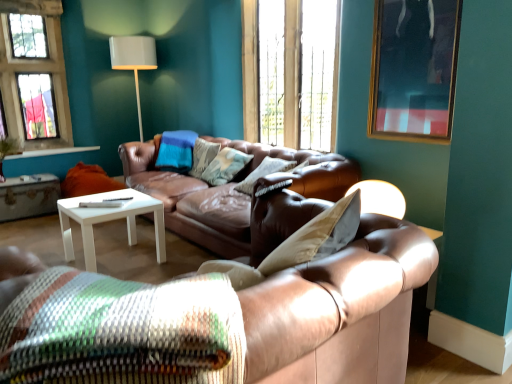
Describe the element at coordinates (225, 166) in the screenshot. I see `textured beige pillow at center, the third pillow in the front-to-back sequence` at that location.

What do you see at coordinates (263, 173) in the screenshot? The image size is (512, 384). I see `textured brown pillow at center, which is the second pillow from back to front` at bounding box center [263, 173].

The height and width of the screenshot is (384, 512). What do you see at coordinates (34, 70) in the screenshot? I see `glass pane window at upper left, the second window from the right` at bounding box center [34, 70].

Find the location of a particular element. The height and width of the screenshot is (384, 512). glass pane window at upper left, the second window from the right is located at coordinates [34, 70].

This screenshot has height=384, width=512. Describe the element at coordinates (291, 72) in the screenshot. I see `wooden frame at upper center, positioned as the 2th window in left-to-right order` at that location.

In order to face metallic gold picture frame at upper right, should I rotate leftwards or rightwards?

Rotate your view right by about 20.371°.

The height and width of the screenshot is (384, 512). What do you see at coordinates (207, 316) in the screenshot?
I see `brown leather couch at center, the 1th studio couch from the front` at bounding box center [207, 316].

This screenshot has width=512, height=384. In order to click on brown leather couch at center, the first studio couch positioned from the back in this screenshot , I will do `click(229, 191)`.

Are white matte coffee table at center and brown leather couch at center, marked as the 2th studio couch in a back-to-front arrangement, making contact?

No, white matte coffee table at center is not touching brown leather couch at center, marked as the 2th studio couch in a back-to-front arrangement.

Which object is thinner, white matte coffee table at center or brown leather couch at center, marked as the 2th studio couch in a back-to-front arrangement?

Thinner between the two is white matte coffee table at center.

In the scene shown: Which is in front, white matte coffee table at center or brown leather couch at center, marked as the 2th studio couch in a back-to-front arrangement?

brown leather couch at center, marked as the 2th studio couch in a back-to-front arrangement.

Between white matte coffee table at center and brown leather couch at center, marked as the 2th studio couch in a back-to-front arrangement, which one has smaller size?

white matte coffee table at center.

How different are the orientations of brown leather couch at center, marked as the 2th studio couch in a back-to-front arrangement, and textured woven pillow at center, arranged as the 1th pillow when viewed from the front, in degrees?

The angle between the facing direction of brown leather couch at center, marked as the 2th studio couch in a back-to-front arrangement, and the facing direction of textured woven pillow at center, arranged as the 1th pillow when viewed from the front, is 0.00164 degrees.

From the image's perspective, would you say brown leather couch at center, the 1th studio couch from the front, is shown under textured woven pillow at center, arranged as the 1th pillow when viewed from the front?

Yes.

Can you confirm if brown leather couch at center, the 1th studio couch from the front, is taller than textured woven pillow at center, which is the third pillow from back to front?

Yes.

Considering the relative positions of brown leather couch at center, the 1th studio couch from the front, and textured woven pillow at center, arranged as the 1th pillow when viewed from the front, in the image provided, is brown leather couch at center, the 1th studio couch from the front, to the left of textured woven pillow at center, arranged as the 1th pillow when viewed from the front, from the viewer's perspective?

No.

From a real-world perspective, is glass pane window at upper left, the 1th window from the left, physically below brown leather couch at center, the second studio couch from the front?

No, from a real-world perspective, glass pane window at upper left, the 1th window from the left, is not under brown leather couch at center, the second studio couch from the front.

From the image's perspective, is glass pane window at upper left, the 1th window from the left, located above or below brown leather couch at center, the first studio couch positioned from the back?

Based on their image positions, glass pane window at upper left, the 1th window from the left, is located above brown leather couch at center, the first studio couch positioned from the back.

Which object is positioned more to the right, glass pane window at upper left, the second window from the right, or brown leather couch at center, the second studio couch from the front?

brown leather couch at center, the second studio couch from the front.

Is glass pane window at upper left, the 1th window from the left, shorter than brown leather couch at center, the second studio couch from the front?

No.

Is metallic gold picture frame at upper right bigger or smaller than brown leather couch at center, the first studio couch positioned from the back?

Considering their sizes, metallic gold picture frame at upper right takes up less space than brown leather couch at center, the first studio couch positioned from the back.

Which object is more forward, metallic gold picture frame at upper right or brown leather couch at center, the first studio couch positioned from the back?

metallic gold picture frame at upper right is closer to the camera.

Is metallic gold picture frame at upper right aimed at brown leather couch at center, the second studio couch from the front?

No, metallic gold picture frame at upper right does not turn towards brown leather couch at center, the second studio couch from the front.

Consider the image. Could you measure the distance between textured woven pillow at center, arranged as the 1th pillow when viewed from the front, and textured beige pillow at center, the first pillow viewed from the back?

textured woven pillow at center, arranged as the 1th pillow when viewed from the front, and textured beige pillow at center, the first pillow viewed from the back, are 8.65 feet apart from each other.

From the image's perspective, is textured woven pillow at center, which is the third pillow from back to front, located above textured beige pillow at center, the third pillow in the front-to-back sequence?

No, from the image's perspective, textured woven pillow at center, which is the third pillow from back to front, is not over textured beige pillow at center, the third pillow in the front-to-back sequence.

From the image's perspective, which pillow is the 2nd one above the textured woven pillow at center, which is the third pillow from back to front? Please provide its 2D coordinates.

[(225, 166)]

Who is smaller, textured woven pillow at center, which is the third pillow from back to front, or textured beige pillow at center, the first pillow viewed from the back?

textured beige pillow at center, the first pillow viewed from the back, is smaller.

From the image's perspective, does metallic gold picture frame at upper right appear lower than wooden frame at upper center, which is counted as the first window, starting from the right?

Indeed, from the image's perspective, metallic gold picture frame at upper right is shown beneath wooden frame at upper center, which is counted as the first window, starting from the right.

Does point (381, 24) lie in front of point (306, 124)?

Yes, point (381, 24) is closer to viewer.

Which of these two, metallic gold picture frame at upper right or wooden frame at upper center, which is counted as the first window, starting from the right, stands taller?

With more height is wooden frame at upper center, which is counted as the first window, starting from the right.

Considering their positions, is metallic gold picture frame at upper right located in front of or behind wooden frame at upper center, which is counted as the first window, starting from the right?

metallic gold picture frame at upper right is positioned closer to the viewer than wooden frame at upper center, which is counted as the first window, starting from the right.

Is textured brown pillow at center, arranged as the second pillow when viewed from the front, bigger than brown leather couch at center, the 1th studio couch from the front?

Actually, textured brown pillow at center, arranged as the second pillow when viewed from the front, might be smaller than brown leather couch at center, the 1th studio couch from the front.

Considering the points (284, 168) and (359, 297), which point is in front, point (284, 168) or point (359, 297)?

The point (359, 297) is in front.

From the textured brown pillow at center, arranged as the second pillow when viewed from the front, count the 1st studio couch to the left and point to it. Please provide its 2D coordinates.

[(207, 316)]

Is textured brown pillow at center, arranged as the second pillow when viewed from the front, to the right of brown leather couch at center, marked as the 2th studio couch in a back-to-front arrangement, from the viewer's perspective?

Correct, you'll find textured brown pillow at center, arranged as the second pillow when viewed from the front, to the right of brown leather couch at center, marked as the 2th studio couch in a back-to-front arrangement.

Identify the location of coffee table lying on the left of brown leather couch at center, marked as the 2th studio couch in a back-to-front arrangement. This screenshot has width=512, height=384. (109, 220).

Identify the location of studio couch below the textured woven pillow at center, which is the third pillow from back to front (from the image's perspective). The image size is (512, 384). (207, 316).

When comparing their distances from brown leather couch at center, the second studio couch from the front, does wooden frame at upper center, positioned as the 2th window in left-to-right order, or white matte coffee table at center seem closer?

white matte coffee table at center is positioned closer to the anchor brown leather couch at center, the second studio couch from the front.

When comparing their distances from white wood side table at lower left, does metallic gold picture frame at upper right or white matte coffee table at center seem further?

The object further to white wood side table at lower left is metallic gold picture frame at upper right.

When comparing their distances from textured brown pillow at center, arranged as the second pillow when viewed from the front, does brown leather couch at center, the second studio couch from the front, or white matte coffee table at center seem further?

white matte coffee table at center.

Which object lies nearer to the anchor point metallic gold picture frame at upper right, glass pane window at upper left, the second window from the right, or textured beige pillow at center, the third pillow in the front-to-back sequence?

Among the two, textured beige pillow at center, the third pillow in the front-to-back sequence, is located nearer to metallic gold picture frame at upper right.

Considering their positions, is white wood side table at lower left positioned further to brown leather couch at center, the first studio couch positioned from the back, than glass pane window at upper left, the second window from the right?

Based on the image, glass pane window at upper left, the second window from the right, appears to be further to brown leather couch at center, the first studio couch positioned from the back.

Based on the photo, looking at the image, which one is located further to white matte coffee table at center, brown leather couch at center, the second studio couch from the front, or wooden frame at upper center, positioned as the 2th window in left-to-right order?

wooden frame at upper center, positioned as the 2th window in left-to-right order.

From the image, which object appears to be farther from textured woven pillow at center, which is the third pillow from back to front, brown leather couch at center, the second studio couch from the front, or textured brown pillow at center, which is the second pillow from back to front?

textured brown pillow at center, which is the second pillow from back to front, is positioned further to the anchor textured woven pillow at center, which is the third pillow from back to front.

Considering their positions, is wooden frame at upper center, which is counted as the first window, starting from the right, positioned closer to brown leather couch at center, the second studio couch from the front, than metallic gold picture frame at upper right?

Among the two, wooden frame at upper center, which is counted as the first window, starting from the right, is located nearer to brown leather couch at center, the second studio couch from the front.

Locate an element on the screen. The height and width of the screenshot is (384, 512). window between brown leather couch at center, the second studio couch from the front, and metallic gold picture frame at upper right from left to right is located at coordinates coord(291,72).

Locate an element on the screen. The width and height of the screenshot is (512, 384). coffee table between glass pane window at upper left, the second window from the right, and wooden frame at upper center, positioned as the 2th window in left-to-right order is located at coordinates (109, 220).

Locate an element on the screen. picture frame between brown leather couch at center, the 1th studio couch from the front, and textured brown pillow at center, arranged as the second pillow when viewed from the front, along the z-axis is located at coordinates (414, 69).

You are a GUI agent. You are given a task and a screenshot of the screen. Output one action in this format:
    pyautogui.click(x=<x>, y=<y>)
    Task: Click on the side table between glass pane window at upper left, the 1th window from the left, and textured brown pillow at center, which is the second pillow from back to front, from left to right
    
    Given the screenshot: What is the action you would take?
    pyautogui.click(x=29, y=197)